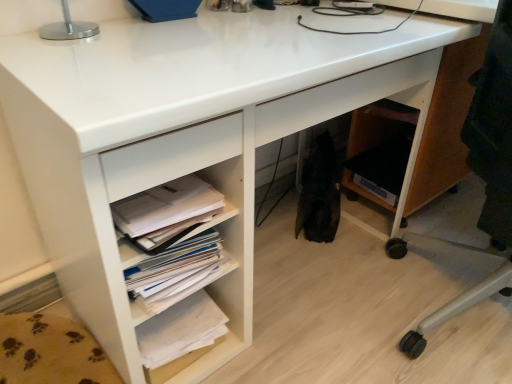
The height and width of the screenshot is (384, 512). Find the location of `free location to the right of white paper stack at lower left, placed as the 1th book when sorted from bottom to top`. free location to the right of white paper stack at lower left, placed as the 1th book when sorted from bottom to top is located at coordinates (261, 360).